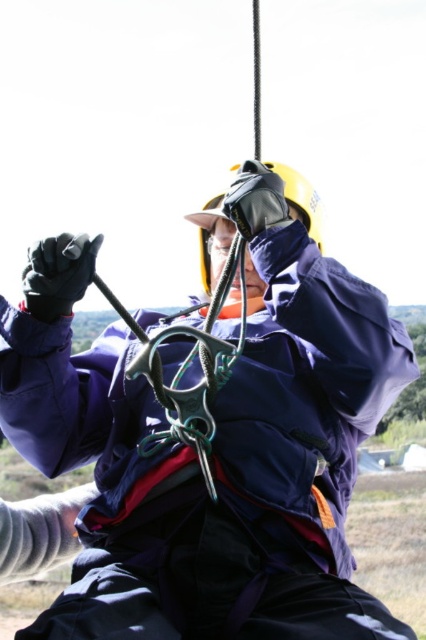
Who is shorter, navy blue jacket at center or yellow matte helmet at center?

yellow matte helmet at center is shorter.

Is navy blue jacket at center to the left of yellow matte helmet at center from the viewer's perspective?

Yes, navy blue jacket at center is to the left of yellow matte helmet at center.

Locate an element on the screen. This screenshot has width=426, height=640. navy blue jacket at center is located at coordinates (213, 442).